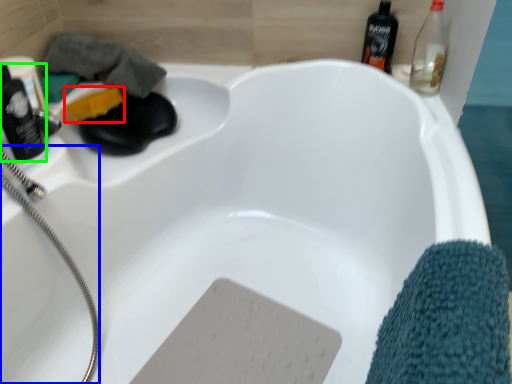
Question: Based on their relative distances, which object is nearer to soap (highlighted by a red box)? Choose from garden hose (highlighted by a blue box) and bottle (highlighted by a green box).

Choices:
 (A) garden hose
 (B) bottle

Answer: (B)